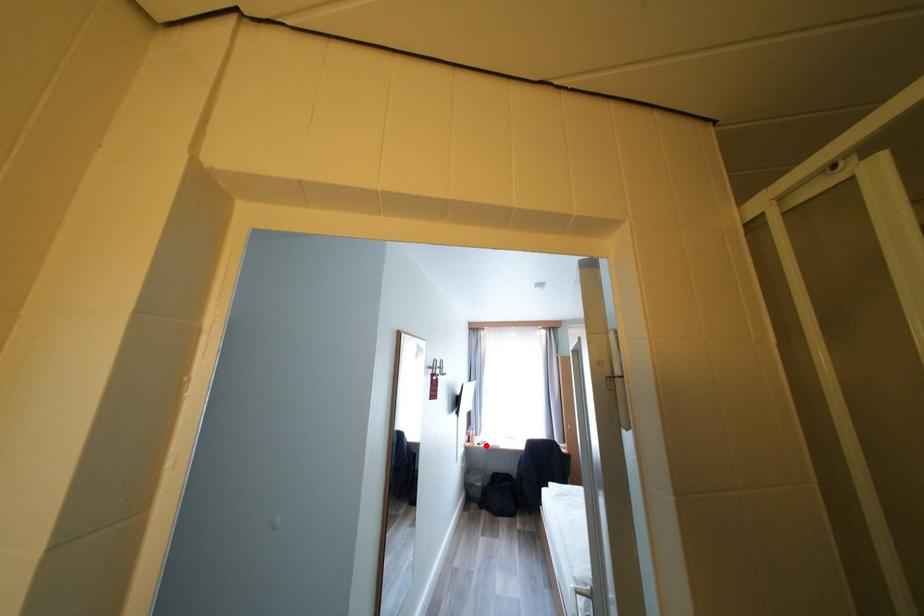
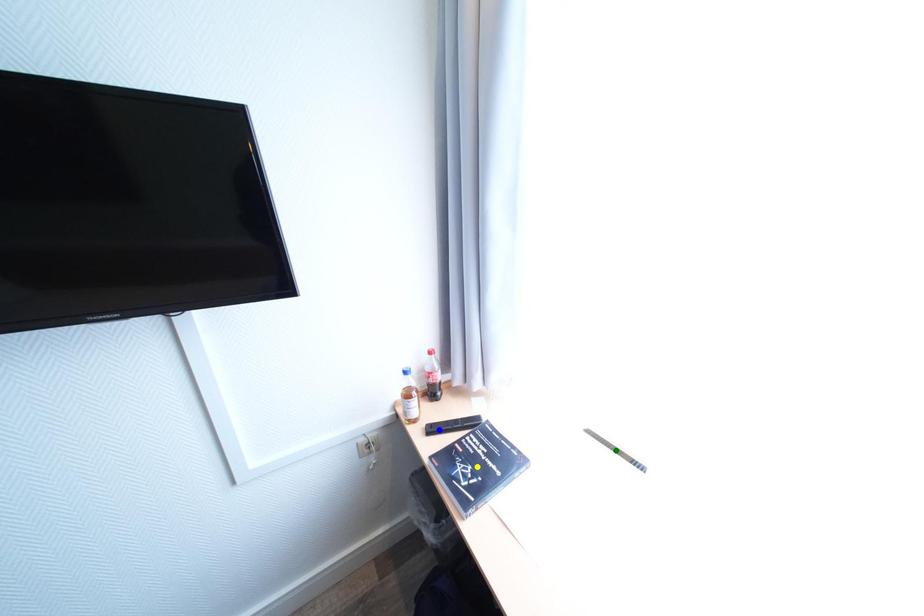
Question: I am providing you with two images of the same scene from different viewpoints. A red point is marked on the first image. You are given multiple points on the second image. Which point in image 2 represents the same 3d spot as the red point in image 1?

Choices:
 (A) blue point
 (B) green point
 (C) yellow point

Answer: (A)